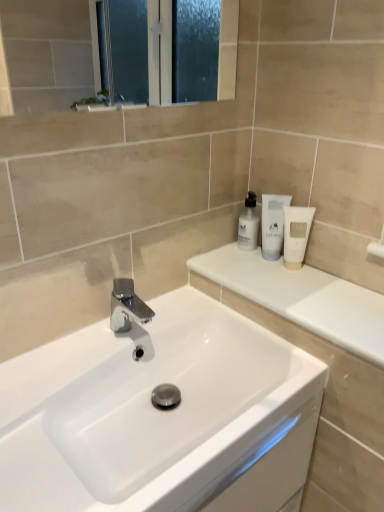
Find the location of a particular element. The width and height of the screenshot is (384, 512). vacant area that lies in front of white glossy lotion at upper right, positioned as the third toiletry in right-to-left order is located at coordinates click(261, 279).